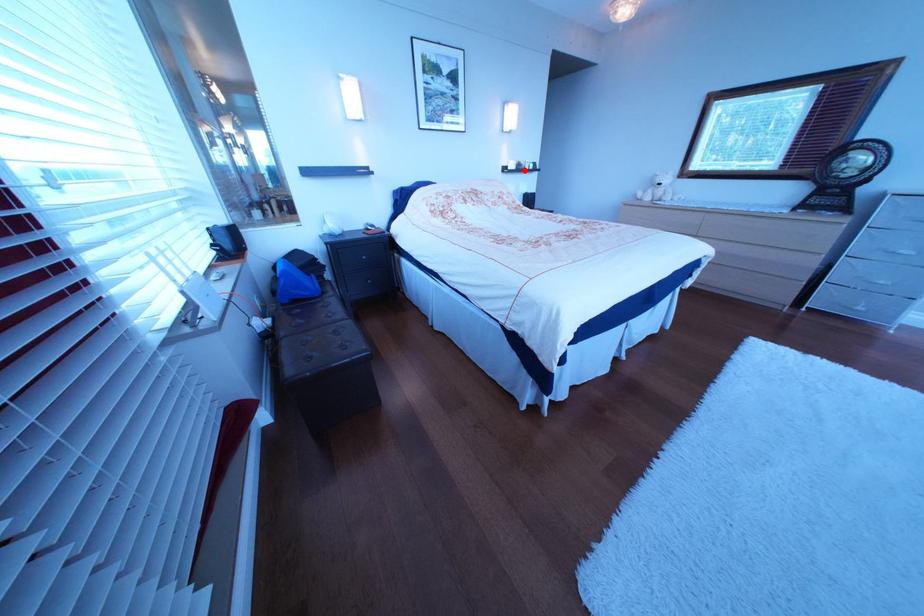
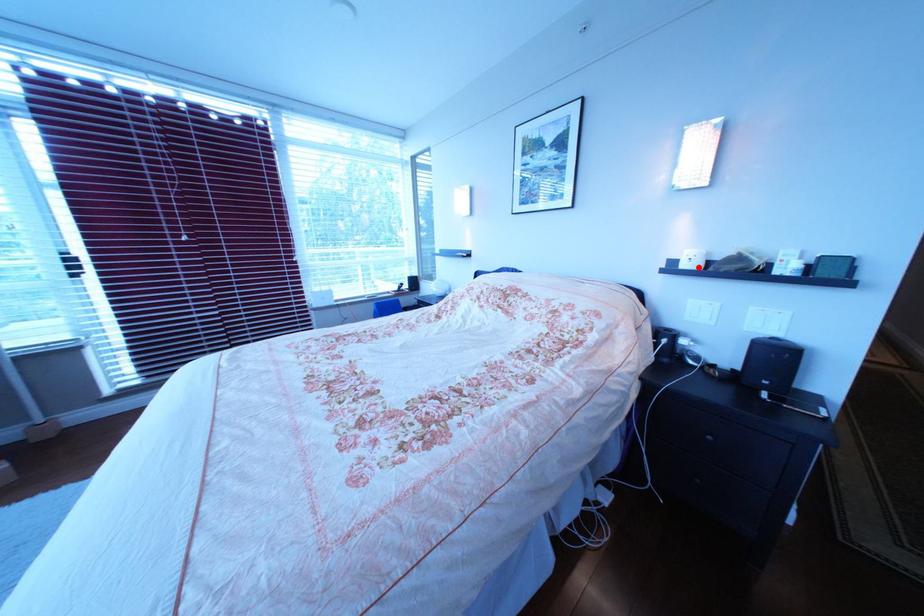
I am providing you with two images of the same scene from different viewpoints. A red point is marked on the first image and another point is marked on the second image. Are the points marked in image1 and image2 representing the same 3D position?

Yes